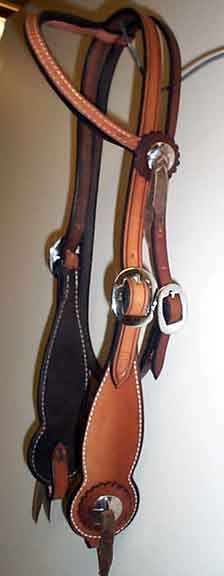
Locate an element on the screen. The height and width of the screenshot is (576, 224). wall is located at coordinates (163, 458).